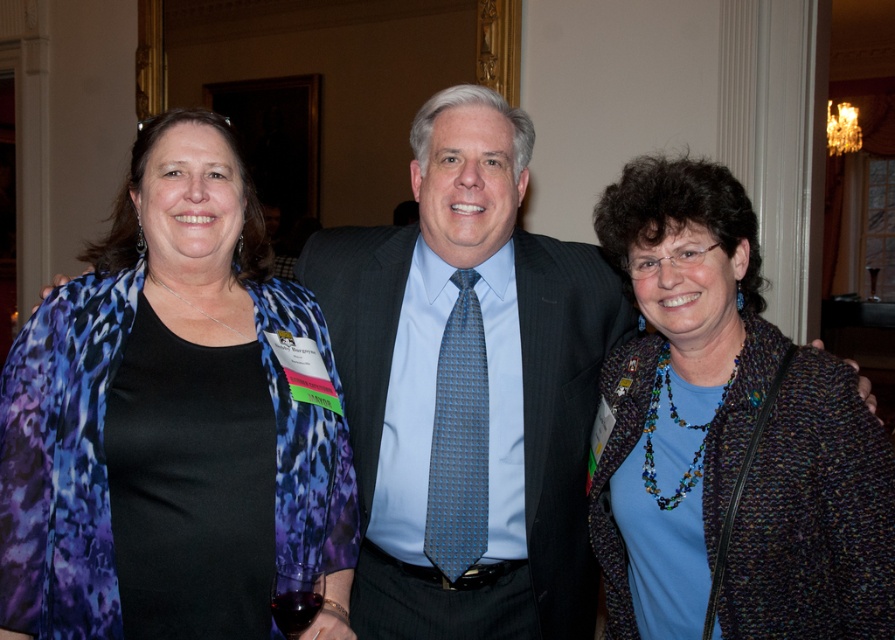
Is dark gray pinstripe suit at center bigger than blue textured tie at center?

Indeed, dark gray pinstripe suit at center has a larger size compared to blue textured tie at center.

Can you confirm if dark gray pinstripe suit at center is smaller than blue textured tie at center?

No, dark gray pinstripe suit at center is not smaller than blue textured tie at center.

Does point (372, 426) lie in front of point (433, 413)?

No, it is not.

At what (x,y) coordinates should I click in order to perform the action: click on dark gray pinstripe suit at center. Please return your answer as a coordinate pair (x, y). This screenshot has width=895, height=640. Looking at the image, I should click on (563, 413).

Is multicolored knitted sweater at center shorter than blue textured tie at center?

No, multicolored knitted sweater at center is not shorter than blue textured tie at center.

Which of these two, multicolored knitted sweater at center or blue textured tie at center, stands shorter?

Standing shorter between the two is blue textured tie at center.

Is point (706, 243) in front of point (435, 470)?

Yes, point (706, 243) is closer to viewer.

This screenshot has width=895, height=640. What are the coordinates of `multicolored knitted sweater at center` in the screenshot? It's located at (678, 388).

Does matte black shirt at center lie in front of dark gray pinstripe suit at center?

Yes, it is.

Which is more to the right, matte black shirt at center or dark gray pinstripe suit at center?

dark gray pinstripe suit at center

Is point (3, 381) positioned behind point (548, 496)?

No, it is not.

Locate an element on the screen. This screenshot has width=895, height=640. matte black shirt at center is located at coordinates (166, 419).